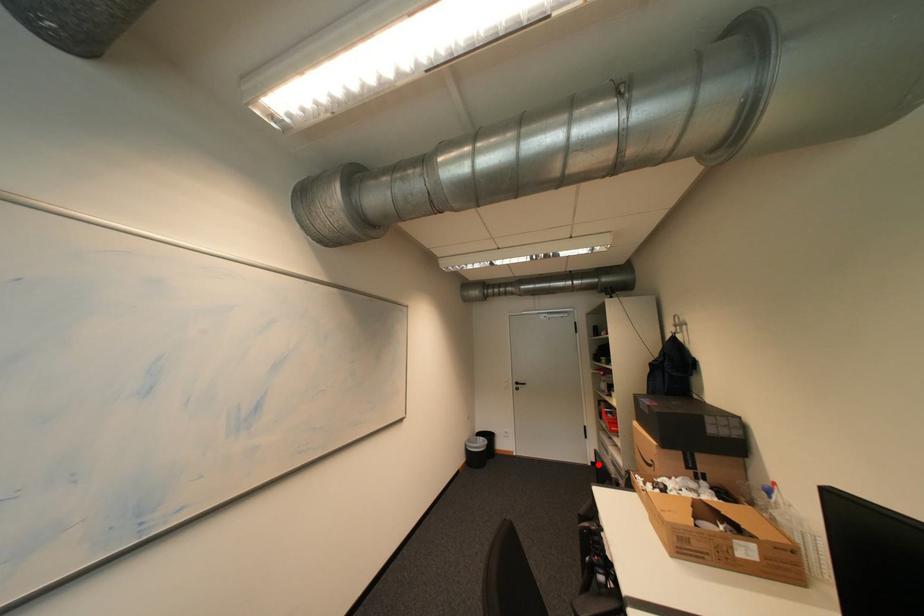
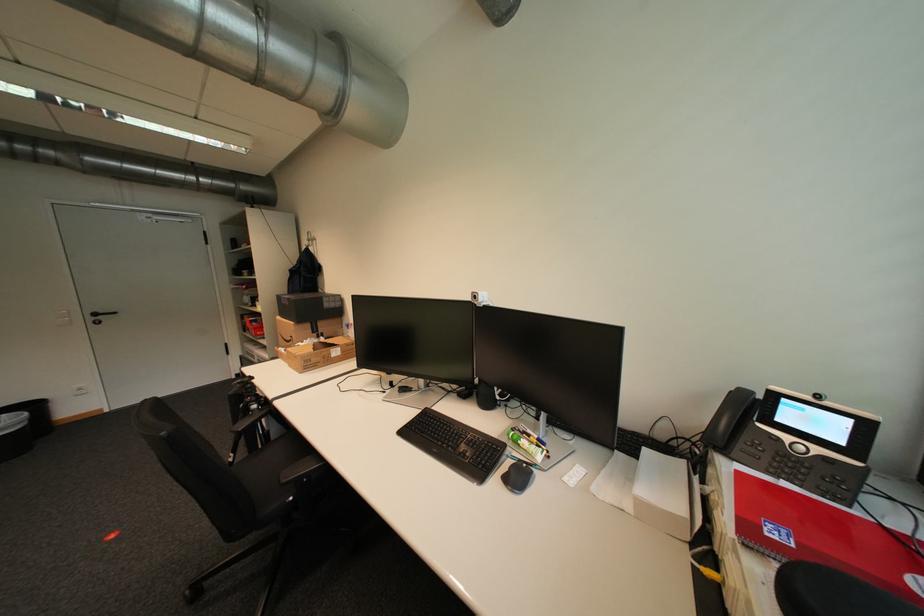
Question: I am providing you with two images of the same scene from different viewpoints. In image1, a red point is highlighted. Considering the same 3D point in image2, which of the following is correct?

Choices:
 (A) It is closer
 (B) It is farther

Answer: (B)